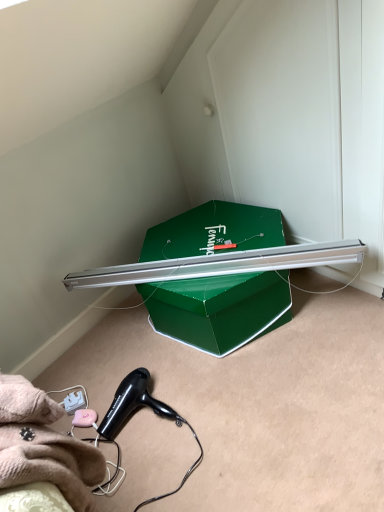
At what (x,y) coordinates should I click in order to perform the action: click on vacant region to the left of green cardboard box at center. Please return your answer as a coordinate pair (x, y). The width and height of the screenshot is (384, 512). Looking at the image, I should click on (118, 350).